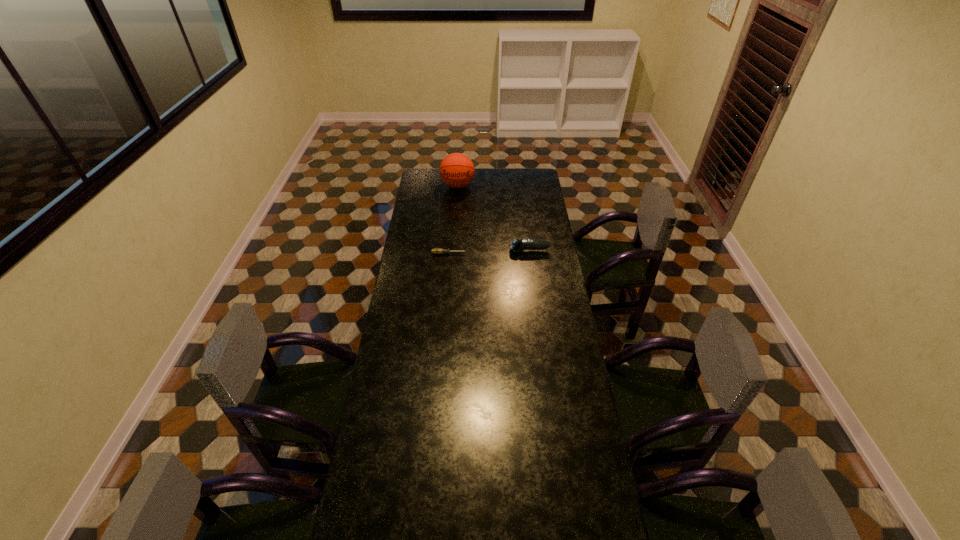
The height and width of the screenshot is (540, 960). What are the coordinates of `object situated at the far edge` in the screenshot? It's located at (457, 170).

Identify the location of basketball at the left edge. Image resolution: width=960 pixels, height=540 pixels. tap(457, 170).

Identify the location of screwdriver that is positioned at the left edge. This screenshot has width=960, height=540. (436, 251).

Where is `object present at the right edge`? object present at the right edge is located at coordinates (516, 245).

Find the location of a particular element. object present at the far left corner is located at coordinates (457, 170).

I want to click on vacant space at the far edge of the desktop, so click(x=479, y=175).

In the image, there is a desktop. Where is `vacant area at the left edge`? The height and width of the screenshot is (540, 960). vacant area at the left edge is located at coordinates (412, 213).

In order to click on vacant space at the right edge in this screenshot , I will do `click(550, 291)`.

Find the location of `free space at the far left corner`. free space at the far left corner is located at coordinates (425, 187).

The width and height of the screenshot is (960, 540). I want to click on free space between the electric shaver and the farthest object, so click(x=493, y=218).